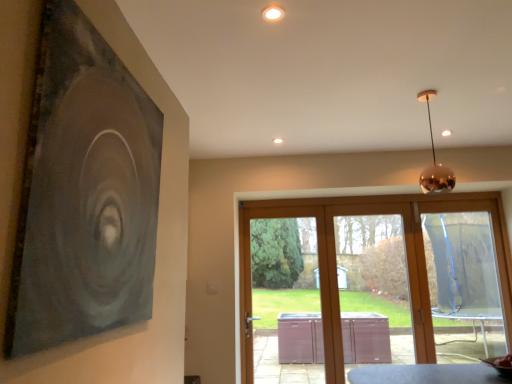
Question: Should I look upward or downward to see matte black painting at upper left?

Choices:
 (A) down
 (B) up

Answer: (A)

Question: Is matte black painting at upper left looking in the opposite direction of copper metallic sphere at upper right?

Choices:
 (A) no
 (B) yes

Answer: (A)

Question: Is matte black painting at upper left further to the viewer compared to copper metallic sphere at upper right?

Choices:
 (A) yes
 (B) no

Answer: (B)

Question: Does matte black painting at upper left have a greater width compared to copper metallic sphere at upper right?

Choices:
 (A) no
 (B) yes

Answer: (A)

Question: Are matte black painting at upper left and copper metallic sphere at upper right beside each other?

Choices:
 (A) yes
 (B) no

Answer: (B)

Question: Can you confirm if matte black painting at upper left is smaller than copper metallic sphere at upper right?

Choices:
 (A) yes
 (B) no

Answer: (B)

Question: Is matte black painting at upper left to the left of copper metallic sphere at upper right from the viewer's perspective?

Choices:
 (A) no
 (B) yes

Answer: (B)

Question: Can you confirm if transparent plastic screen door at center is wider than transparent plastic screen at right?

Choices:
 (A) no
 (B) yes

Answer: (A)

Question: Would you say transparent plastic screen at right is part of transparent plastic screen door at center's contents?

Choices:
 (A) yes
 (B) no

Answer: (B)

Question: Can you confirm if transparent plastic screen door at center is positioned to the left of transparent plastic screen at right?

Choices:
 (A) yes
 (B) no

Answer: (A)

Question: From the image's perspective, is transparent plastic screen door at center under transparent plastic screen at right?

Choices:
 (A) yes
 (B) no

Answer: (A)

Question: Is transparent plastic screen door at center closer to the viewer compared to transparent plastic screen at right?

Choices:
 (A) yes
 (B) no

Answer: (B)

Question: Can you confirm if transparent plastic screen door at center is shorter than transparent plastic screen at right?

Choices:
 (A) no
 (B) yes

Answer: (A)

Question: Can transparent glass door at center be found inside copper metallic sphere at upper right?

Choices:
 (A) yes
 (B) no

Answer: (B)